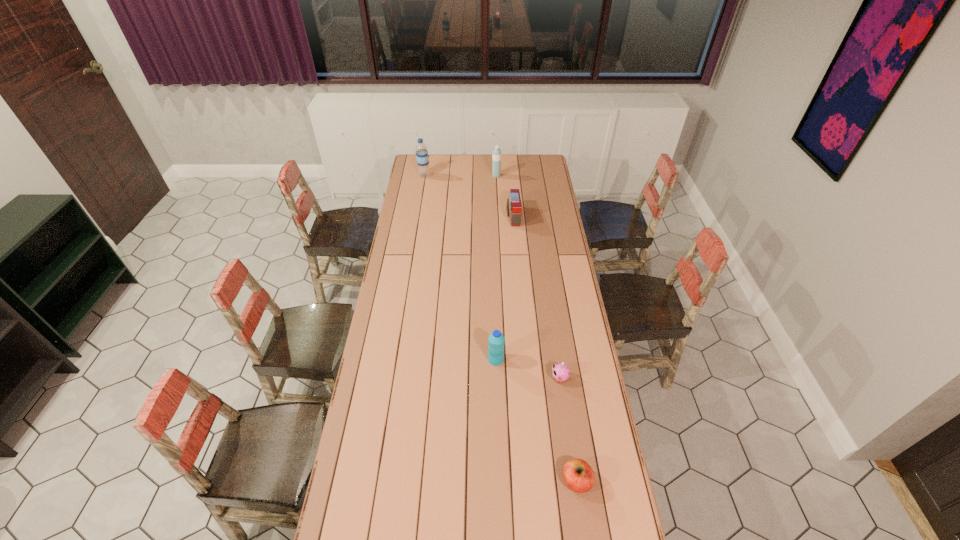
Find the location of a particular element. This screenshot has width=960, height=540. object present at the far left corner is located at coordinates (422, 158).

Find the location of a particular element. The height and width of the screenshot is (540, 960). free region at the far edge of the desktop is located at coordinates (472, 169).

Locate an element on the screen. vacant region at the left edge of the desktop is located at coordinates (416, 186).

I want to click on free space at the right edge of the desktop, so click(580, 375).

The width and height of the screenshot is (960, 540). In order to click on empty space between the tallest water bottle and the third farthest object in this screenshot , I will do tap(468, 196).

Find the location of `empty space that is in between the tallest water bottle and the nearest water bottle`. empty space that is in between the tallest water bottle and the nearest water bottle is located at coordinates click(460, 267).

In order to click on free spot between the tallest water bottle and the second nearest object in this screenshot , I will do (492, 277).

This screenshot has height=540, width=960. Find the location of `free space that is in between the fourth shortest object and the fourth tallest object`. free space that is in between the fourth shortest object and the fourth tallest object is located at coordinates (504, 288).

Find the location of a particular element. The image size is (960, 540). vacant space that's between the third nearest object and the tallest water bottle is located at coordinates (460, 267).

You are a GUI agent. You are given a task and a screenshot of the screen. Output one action in this format:
    pyautogui.click(x=<x>, y=<y>)
    Task: Click on the object that is the fifth closest one to the leftmost object
    The height and width of the screenshot is (540, 960).
    Given the screenshot: What is the action you would take?
    pyautogui.click(x=578, y=475)